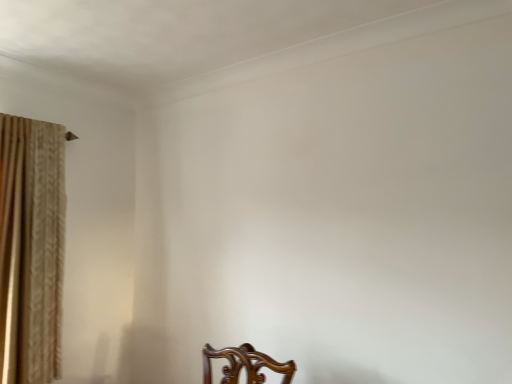
Where is `beige textured curtain at left`? beige textured curtain at left is located at coordinates (31, 249).

The image size is (512, 384). What do you see at coordinates (31, 249) in the screenshot?
I see `beige textured curtain at left` at bounding box center [31, 249].

The height and width of the screenshot is (384, 512). I want to click on beige textured curtain at left, so point(31,249).